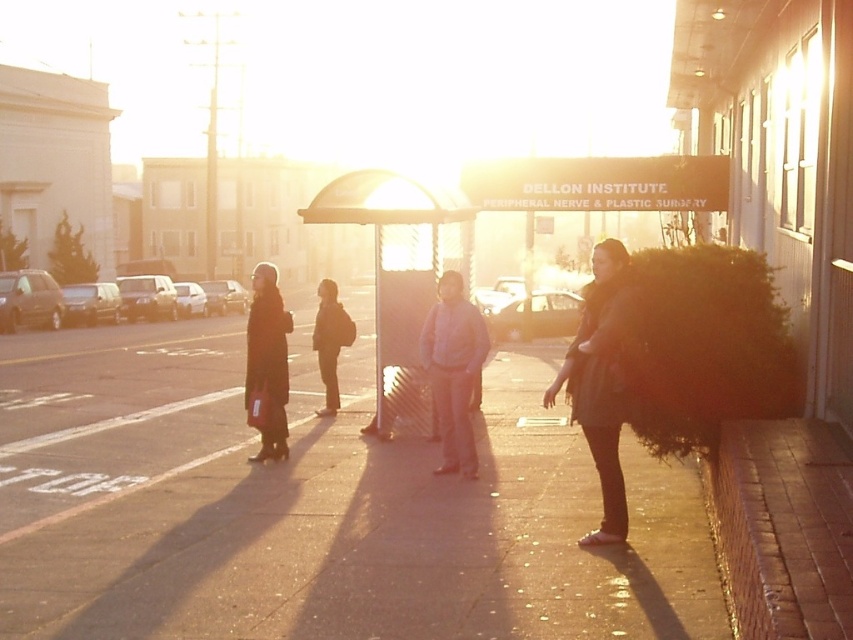
Question: Can you confirm if matte black coat at left is thinner than dark gray jacket at center?

Choices:
 (A) yes
 (B) no

Answer: (B)

Question: Is the position of light blue denim jacket at center less distant than that of dark gray jacket at center?

Choices:
 (A) no
 (B) yes

Answer: (B)

Question: Among these objects, which one is nearest to the camera?

Choices:
 (A) brick at lower right
 (B) dark gray jacket at center

Answer: (A)

Question: Based on their relative distances, which object is nearer to the matte black coat at left?

Choices:
 (A) dark gray jacket at center
 (B) dark brown fur coat at right

Answer: (A)

Question: Which is farther from the dark gray jacket at center?

Choices:
 (A) matte black coat at left
 (B) brick at lower right
 (C) smooth concrete sidewalk at center
 (D) dark brown fur coat at right

Answer: (B)

Question: Does dark brown fur coat at right appear under dark gray jacket at center?

Choices:
 (A) yes
 (B) no

Answer: (A)